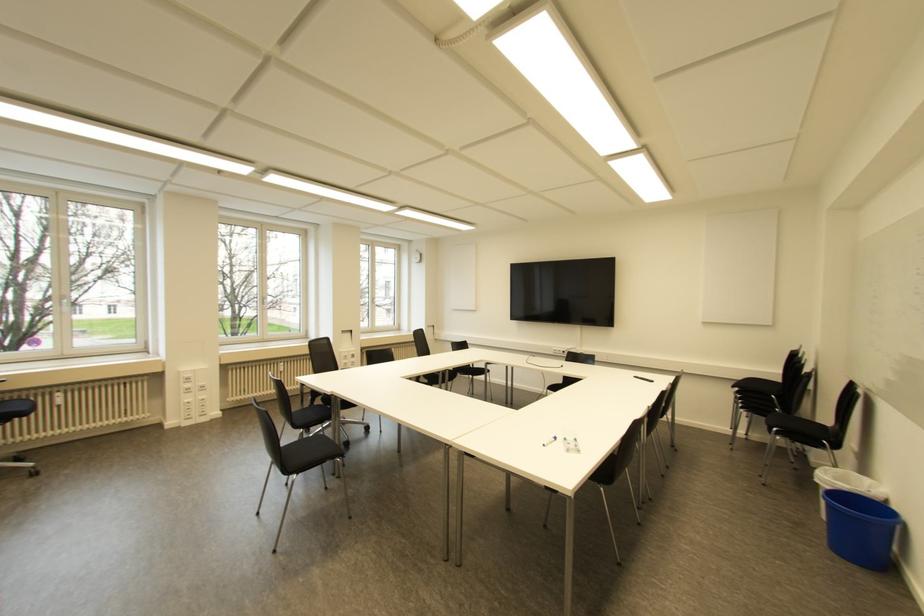
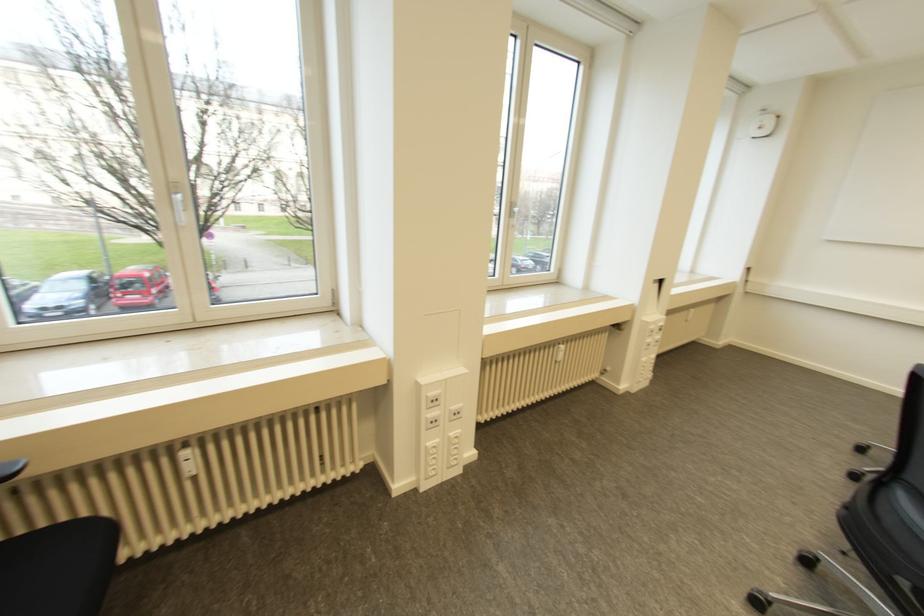
What movement of the cameraman would produce the second image?

The movement direction of the cameraman is left, forward.